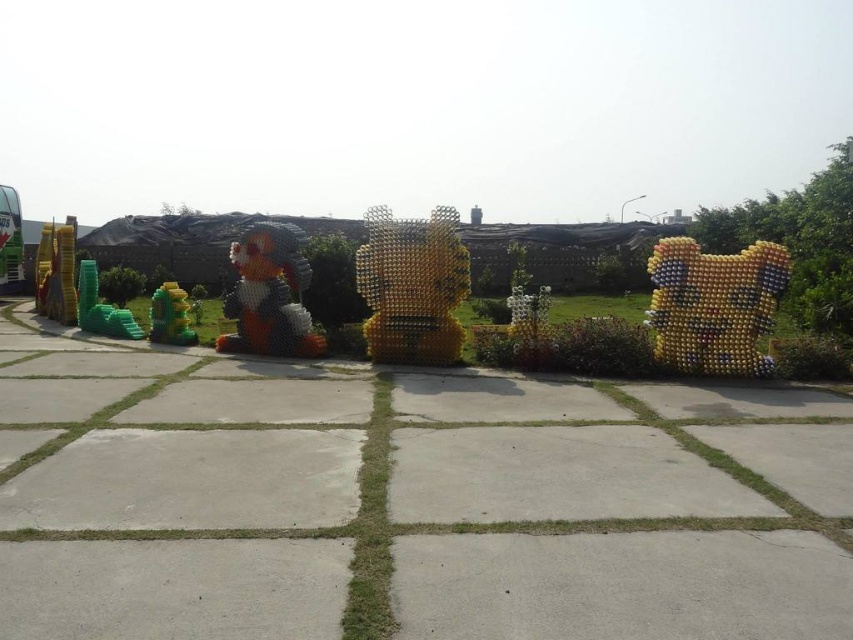
Question: Based on their relative distances, which object is nearer to the multicolored plastic bottle at right?

Choices:
 (A) shiny green toy at lower left
 (B) yellow metallic sculpture at center
 (C) multicolored plastic bottle at center

Answer: (B)

Question: Where is multicolored plastic bottle at center located in relation to shiny green toy at lower left in the image?

Choices:
 (A) right
 (B) left

Answer: (A)

Question: Which is nearer to the multicolored plastic bottle at right?

Choices:
 (A) shiny green toy at lower left
 (B) multicolored plastic bottle at center
 (C) yellow metallic sculpture at center

Answer: (C)

Question: Estimate the real-world distances between objects in this image. Which object is farther from the yellow metallic sculpture at center?

Choices:
 (A) multicolored plastic bottle at center
 (B) shiny green toy at lower left

Answer: (B)

Question: From the image, what is the correct spatial relationship of multicolored plastic bottle at center in relation to shiny green toy at lower left?

Choices:
 (A) above
 (B) below

Answer: (A)

Question: From the image, what is the correct spatial relationship of multicolored plastic bottle at right in relation to yellow metallic sculpture at center?

Choices:
 (A) below
 (B) above

Answer: (A)